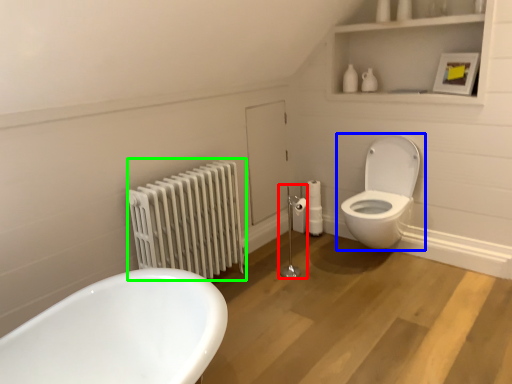
Question: Estimate the real-world distances between objects in this image. Which object is farther from shower (highlighted by a red box), toilet (highlighted by a blue box) or radiator (highlighted by a green box)?

Choices:
 (A) toilet
 (B) radiator

Answer: (B)